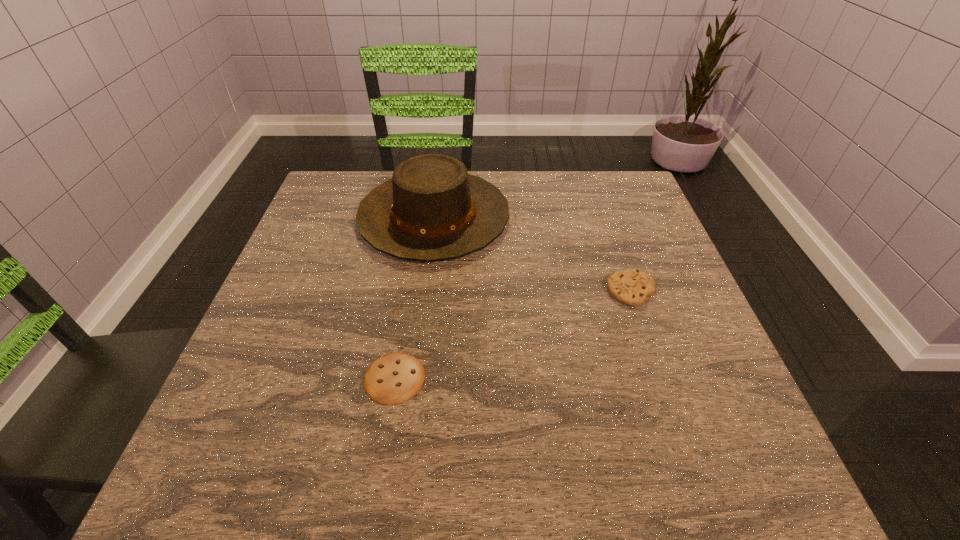
The width and height of the screenshot is (960, 540). I want to click on the second closest object to the nearer cookie, so click(x=632, y=287).

Locate an element on the screen. The width and height of the screenshot is (960, 540). free space in the image that satisfies the following two spatial constraints: 1. on the back side of the shortest object; 2. on the right side of the farthest object is located at coordinates (420, 217).

Find the location of `vacant region that satisfies the following two spatial constraints: 1. on the back side of the nearest object; 2. on the right side of the farthest object`. vacant region that satisfies the following two spatial constraints: 1. on the back side of the nearest object; 2. on the right side of the farthest object is located at coordinates (420, 217).

Where is `vacant area in the image that satisfies the following two spatial constraints: 1. on the front side of the farther cookie; 2. on the right side of the farthest object`? The height and width of the screenshot is (540, 960). vacant area in the image that satisfies the following two spatial constraints: 1. on the front side of the farther cookie; 2. on the right side of the farthest object is located at coordinates (424, 291).